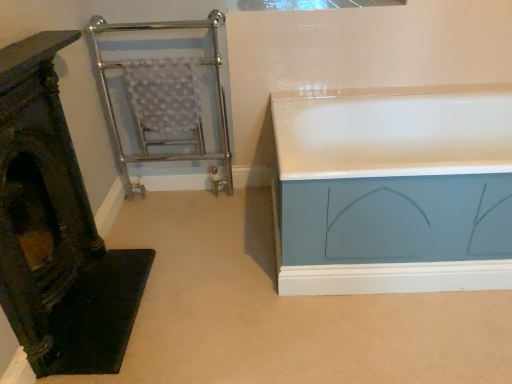
Question: In terms of width, does chrome/metal towel rack at left look wider or thinner when compared to wooden carved chair at left?

Choices:
 (A) wide
 (B) thin

Answer: (A)

Question: In the image, is chrome/metal towel rack at left on the left side or the right side of wooden carved chair at left?

Choices:
 (A) left
 (B) right

Answer: (B)

Question: Estimate the real-world distances between objects in this image. Which object is closer to the wooden carved chair at left?

Choices:
 (A) white glossy bathtub at right
 (B) chrome/metal towel rack at left
 (C) transparent glass window at upper center

Answer: (B)

Question: Based on their relative distances, which object is nearer to the chrome/metal towel rack at left?

Choices:
 (A) wooden carved chair at left
 (B) transparent glass window at upper center
 (C) white glossy bathtub at right

Answer: (B)